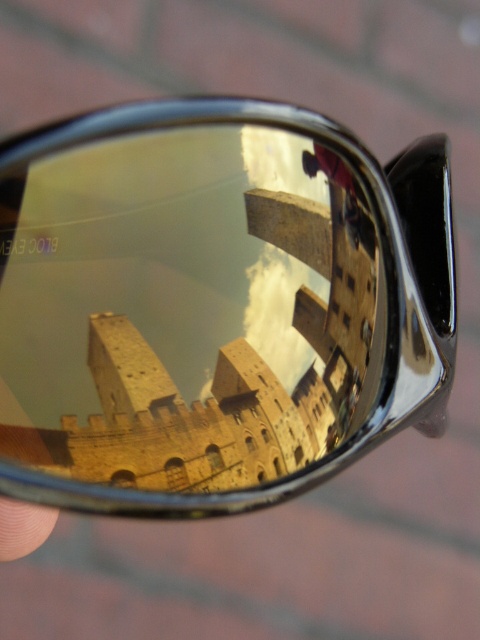
Is shiny metallic sunglasses at center further to camera compared to skinsmoothhand at lower left?

That is False.

Can you confirm if shiny metallic sunglasses at center is wider than skinsmoothhand at lower left?

Yes, shiny metallic sunglasses at center is wider than skinsmoothhand at lower left.

Is point (132, 323) positioned before point (2, 500)?

No, it is behind (2, 500).

The image size is (480, 640). Identify the location of shiny metallic sunglasses at center. (215, 305).